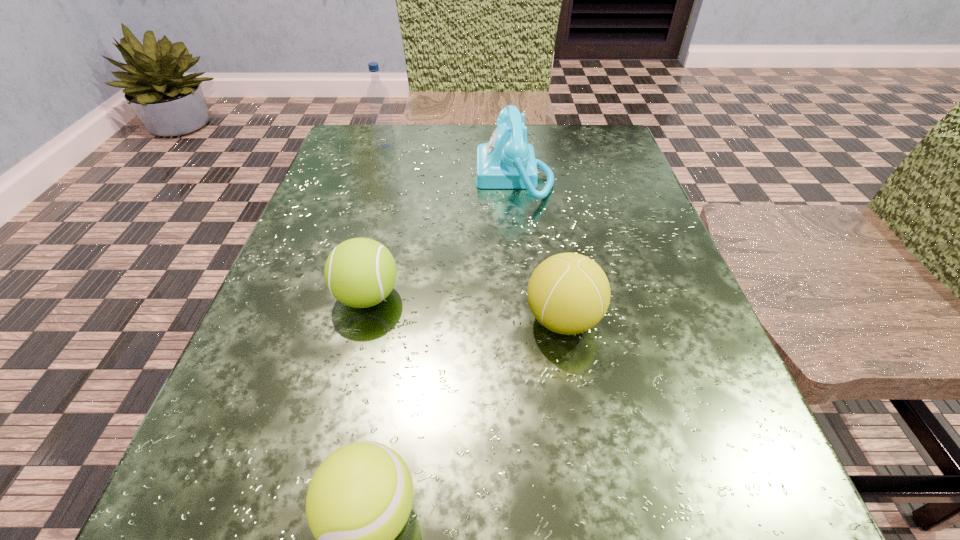
Identify the location of vacant space in between the telephone and the tallest object. This screenshot has width=960, height=540. (450, 161).

Find the location of a particular element. The width and height of the screenshot is (960, 540). vacant space that's between the water bottle and the rightmost tennis ball is located at coordinates (474, 233).

Find the location of a particular element. This screenshot has width=960, height=540. free space between the telephone and the tallest object is located at coordinates (450, 161).

Find the location of a particular element. free spot between the telephone and the water bottle is located at coordinates (450, 161).

Identify which object is the nearest to the rightmost tennis ball. Please provide its 2D coordinates. Your answer should be formatted as a tuple, i.e. [(x, y)], where the tuple contains the x and y coordinates of a point satisfying the conditions above.

[(360, 272)]

You are a GUI agent. You are given a task and a screenshot of the screen. Output one action in this format:
    pyautogui.click(x=<x>, y=<y>)
    Task: Click on the object that is the third closest to the telephone
    The height and width of the screenshot is (540, 960).
    Given the screenshot: What is the action you would take?
    pyautogui.click(x=568, y=293)

Select which tennis ball appears as the third closest to the tallest object. Please provide its 2D coordinates. Your answer should be formatted as a tuple, i.e. [(x, y)], where the tuple contains the x and y coordinates of a point satisfying the conditions above.

[(359, 499)]

Identify which tennis ball is the second closest to the nearest tennis ball. Please provide its 2D coordinates. Your answer should be formatted as a tuple, i.e. [(x, y)], where the tuple contains the x and y coordinates of a point satisfying the conditions above.

[(360, 272)]

This screenshot has width=960, height=540. In order to click on vacant space that satisfies the following two spatial constraints: 1. on the dial of the telephone; 2. on the left side of the rightmost tennis ball in this screenshot , I will do `click(529, 320)`.